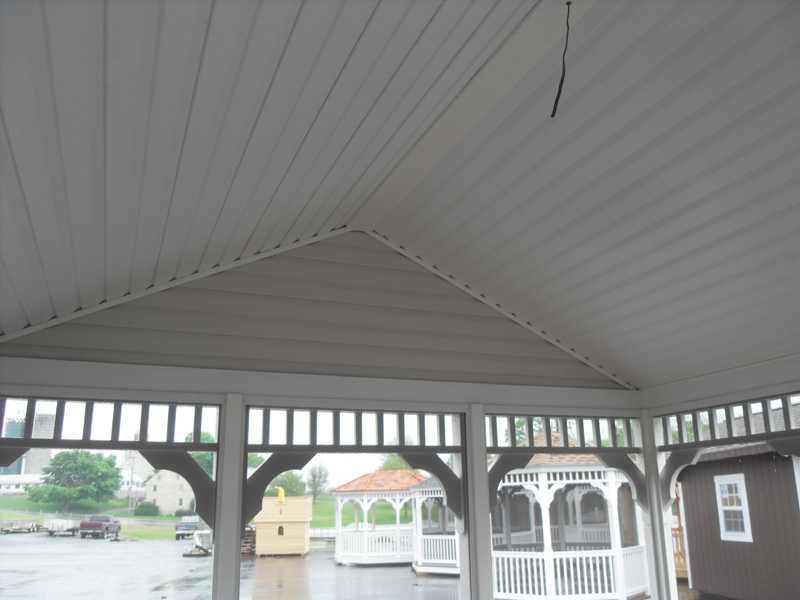
Find the location of `white window frame`. white window frame is located at coordinates (746, 541).